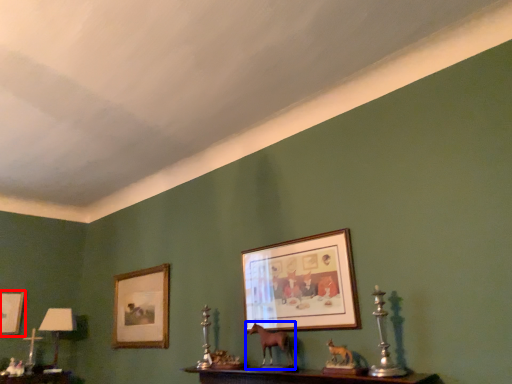
Question: Which of the following is the closest to the observer, picture frame (highlighted by a red box) or animal (highlighted by a blue box)?

Choices:
 (A) picture frame
 (B) animal

Answer: (B)